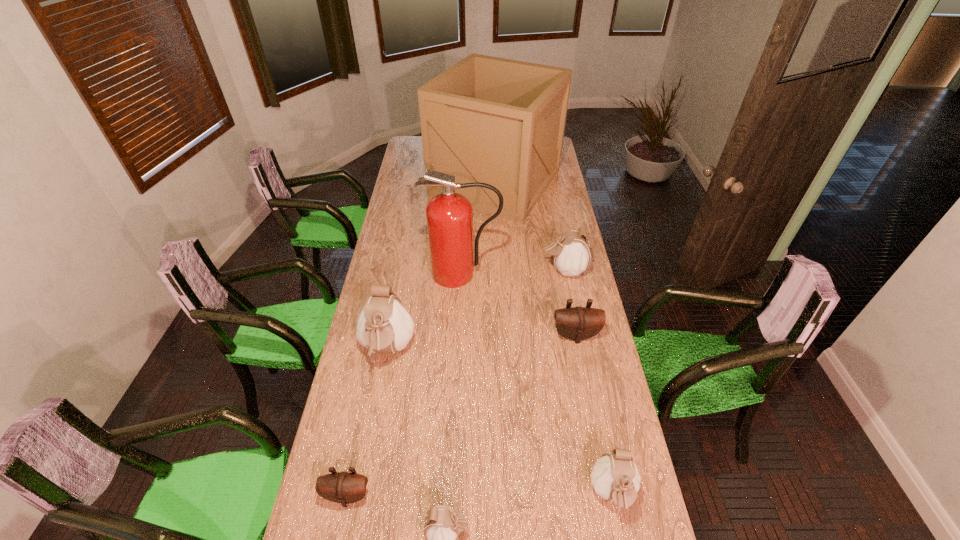
At what (x,y) coordinates should I click in order to perform the action: click on brown box. Please return your answer as a coordinate pair (x, y). The image size is (960, 540). Looking at the image, I should click on (486, 119).

In order to click on box in this screenshot , I will do `click(486, 119)`.

The width and height of the screenshot is (960, 540). In order to click on fire extinguisher in this screenshot , I will do `click(449, 215)`.

The width and height of the screenshot is (960, 540). Find the location of `the third tallest object`. the third tallest object is located at coordinates (384, 325).

Locate an element on the screen. Image resolution: width=960 pixels, height=540 pixels. the leftmost white pouch is located at coordinates (384, 325).

Identify the location of the second biggest white pouch. The image size is (960, 540). (571, 253).

Locate an element on the screen. Image resolution: width=960 pixels, height=540 pixels. the fifth shortest object is located at coordinates pos(571,253).

At what (x,y) coordinates should I click in order to perform the action: click on the second smallest white pouch. Please return your answer as a coordinate pair (x, y). The image size is (960, 540). Looking at the image, I should click on (615, 477).

Where is `the farther brown pouch`? The image size is (960, 540). the farther brown pouch is located at coordinates (578, 323).

Locate an element on the screen. This screenshot has height=540, width=960. the right brown pouch is located at coordinates (578, 323).